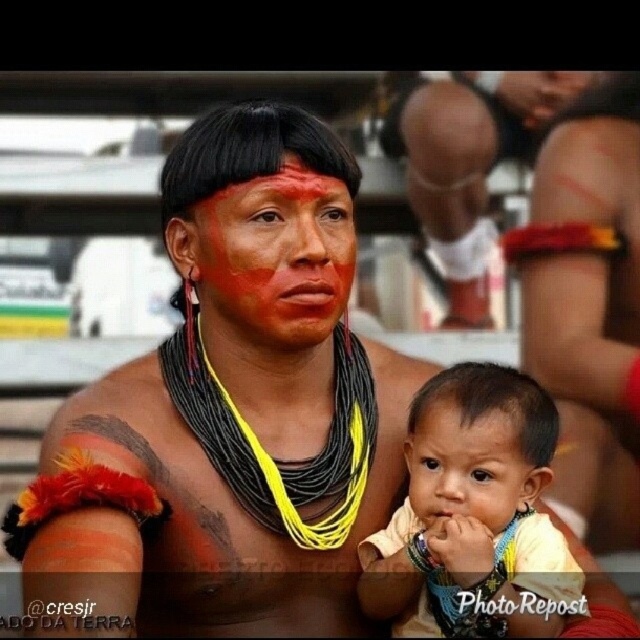
Question: Can you confirm if light yellow fabric baby at center is positioned above matte orange forehead at center?

Choices:
 (A) no
 (B) yes

Answer: (A)

Question: Among these points, which one is nearest to the camera?

Choices:
 (A) (280, 193)
 (B) (554, 412)
 (C) (636, 522)

Answer: (B)

Question: Which point appears closest to the camera in this image?

Choices:
 (A) (579, 381)
 (B) (483, 406)

Answer: (B)

Question: Is matte red face paint at center wider than matte orange forehead at center?

Choices:
 (A) no
 (B) yes

Answer: (B)

Question: Which of the following is the closest to the observer?

Choices:
 (A) (328, 209)
 (B) (524, 483)

Answer: (B)

Question: Can you confirm if reddish-brown painted forehead at upper center is positioned to the right of matte orange forehead at center?

Choices:
 (A) yes
 (B) no

Answer: (B)